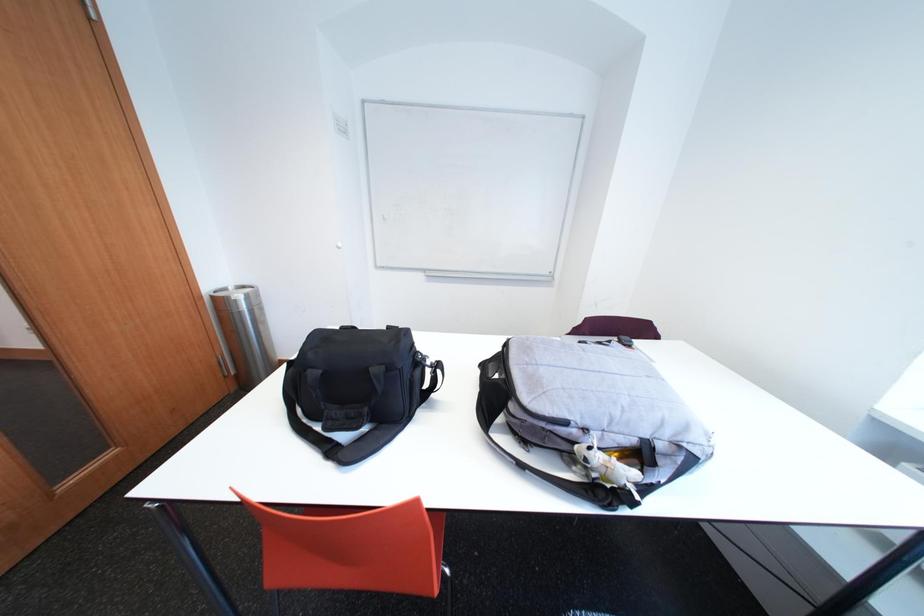
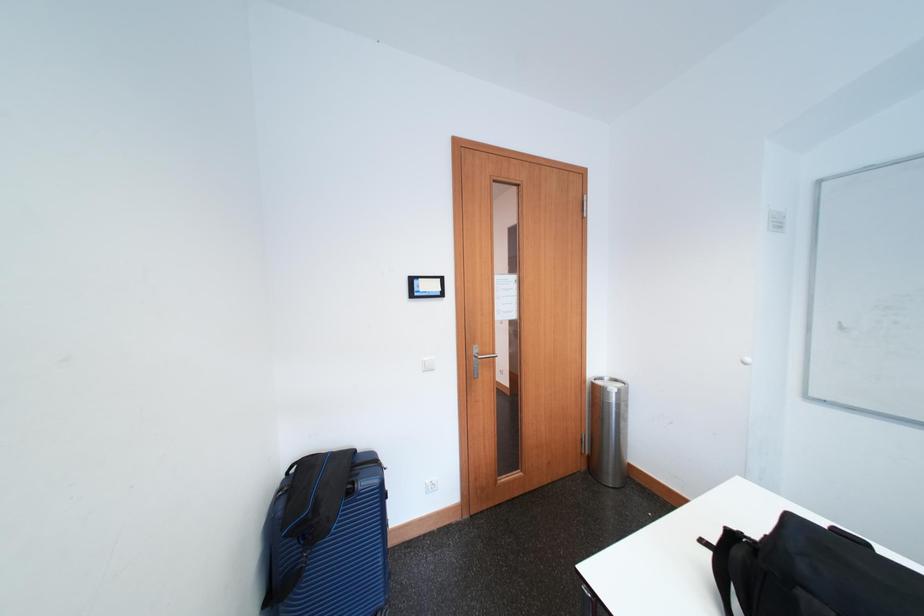
Question: The first image is from the beginning of the video and the second image is from the end. How did the camera likely rotate when shooting the video?

Choices:
 (A) Left
 (B) Right
 (C) Up
 (D) Down

Answer: (A)